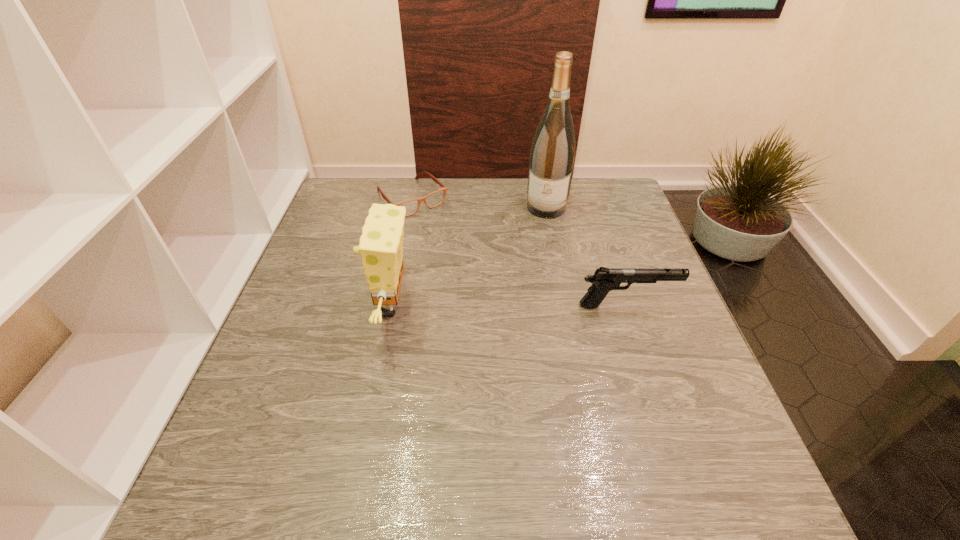
Find the location of `the third shortest object`. the third shortest object is located at coordinates (381, 242).

Locate an element on the screen. The width and height of the screenshot is (960, 540). the second shortest object is located at coordinates pos(604,280).

This screenshot has width=960, height=540. What are the coordinates of `wine bottle` in the screenshot? It's located at (552, 155).

Image resolution: width=960 pixels, height=540 pixels. What are the coordinates of `the shortest object` in the screenshot? It's located at (433, 199).

The width and height of the screenshot is (960, 540). I want to click on vacant region located on the face of the sponge, so click(306, 306).

At what (x,y) coordinates should I click in order to perform the action: click on blank space located 0.160m on the face of the sponge. Please return your answer as a coordinate pair (x, y). Image resolution: width=960 pixels, height=540 pixels. Looking at the image, I should click on (298, 306).

This screenshot has height=540, width=960. Identify the location of free region located on the face of the sponge. (310, 306).

Identify the location of free space located on the label of the wine bottle. (527, 294).

Locate an element on the screen. This screenshot has width=960, height=540. free location located 0.210m on the label of the wine bottle is located at coordinates (533, 266).

The height and width of the screenshot is (540, 960). I want to click on free spot located on the label of the wine bottle, so click(x=520, y=321).